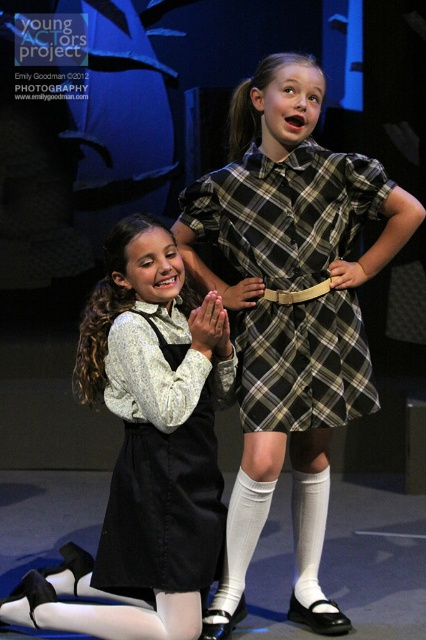
Which is below, plaid fabric dress at center or black cotton dress at lower left?

black cotton dress at lower left is below.

Is point (356, 202) positioned before point (213, 492)?

No, it is not.

Which is behind, point (273, 336) or point (221, 556)?

Point (221, 556)

Identify the location of plaid fabric dress at center. The image size is (426, 640). (285, 211).

You are a GUI agent. You are given a task and a screenshot of the screen. Output one action in this format:
    pyautogui.click(x=<x>, y=<y>)
    Task: Click on the matte black dress at center
    
    Given the screenshot: What is the action you would take?
    pyautogui.click(x=147, y=445)

Between point (158, 364) and point (144, 529), which one is positioned behind?

Positioned behind is point (144, 529).

Which is in front, point (121, 500) or point (169, 512)?

Positioned in front is point (169, 512).

Image resolution: width=426 pixels, height=640 pixels. I want to click on matte black dress at center, so click(147, 445).

Which of these two, matte black dress at center or plaid fabric dress at center, stands taller?

matte black dress at center is taller.

Which of these two, matte black dress at center or plaid fabric dress at center, stands shorter?

Standing shorter between the two is plaid fabric dress at center.

Which is behind, point (187, 460) or point (273, 364)?

The point (273, 364) is behind.

Identify the location of matte black dress at center. (147, 445).